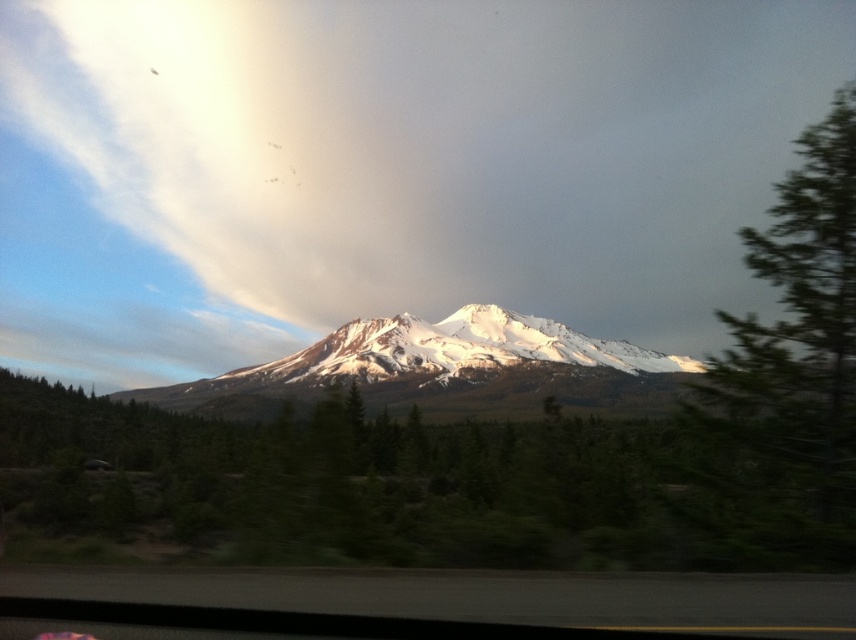
Question: Which point is closer to the camera?

Choices:
 (A) green textured tree at right
 (B) black asphalt highway at lower center
 (C) snowy white mountain at center

Answer: (B)

Question: Can you confirm if green textured tree at right is positioned below snowy white mountain at center?

Choices:
 (A) no
 (B) yes

Answer: (A)

Question: Which point is farther to the camera?

Choices:
 (A) snowy white mountain at center
 (B) green textured tree at right

Answer: (A)

Question: Considering the real-world distances, which object is closest to the snowy white mountain at center?

Choices:
 (A) green textured tree at right
 (B) black asphalt highway at lower center

Answer: (A)

Question: Is black asphalt highway at lower center to the right of snowy white mountain at center from the viewer's perspective?

Choices:
 (A) no
 (B) yes

Answer: (A)

Question: Can you confirm if green textured tree at right is positioned above snowy white mountain at center?

Choices:
 (A) yes
 (B) no

Answer: (A)